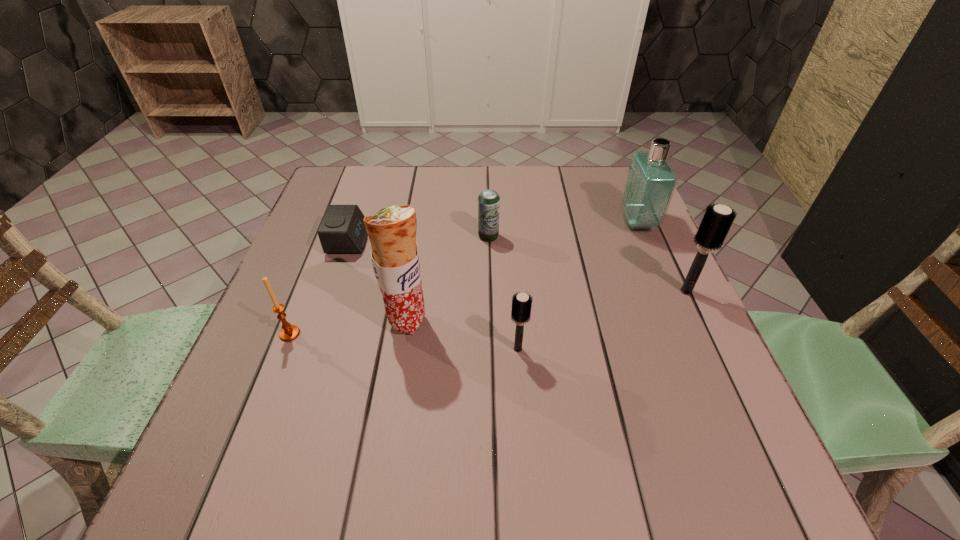
Locate an element on the screen. The width and height of the screenshot is (960, 540). burrito is located at coordinates (392, 231).

The height and width of the screenshot is (540, 960). What are the coordinates of `vacant region located on the left of the shorter hairbrush` in the screenshot? It's located at (463, 349).

What are the coordinates of `vacant region located on the left of the farther hairbrush` in the screenshot? It's located at (598, 291).

Where is `vacant space located on the right of the fourth object from left to right`? The width and height of the screenshot is (960, 540). vacant space located on the right of the fourth object from left to right is located at coordinates (647, 236).

This screenshot has width=960, height=540. In order to click on vacant space located on the front-facing side of the alarm clock in this screenshot , I will do `click(493, 241)`.

The width and height of the screenshot is (960, 540). I want to click on free space located on the front label of the perfume, so click(550, 222).

At what (x,y) coordinates should I click in order to perform the action: click on free space located on the front label of the perfume. Please return your answer as a coordinate pair (x, y). Looking at the image, I should click on (599, 222).

The image size is (960, 540). I want to click on vacant area situated 0.140m on the front label of the perfume, so click(x=569, y=222).

Image resolution: width=960 pixels, height=540 pixels. I want to click on vacant space situated on the back of the candle_holder, so click(303, 298).

Locate an element on the screen. This screenshot has width=960, height=540. vacant region located on the right of the burrito is located at coordinates (558, 321).